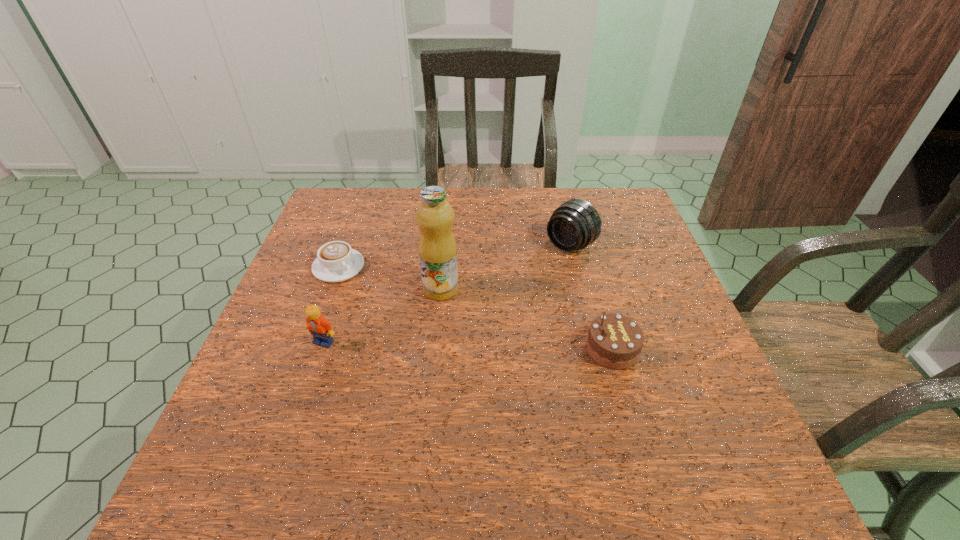
Locate an element on the screen. The height and width of the screenshot is (540, 960). free space that satisfies the following two spatial constraints: 1. on the front side of the cappuccino; 2. on the right side of the tallest object is located at coordinates (330, 289).

This screenshot has width=960, height=540. Find the location of `free region that satisfies the following two spatial constraints: 1. on the front side of the cappuccino; 2. on the right side of the chocolate cake`. free region that satisfies the following two spatial constraints: 1. on the front side of the cappuccino; 2. on the right side of the chocolate cake is located at coordinates (309, 349).

Find the location of `free space that satisfies the following two spatial constraints: 1. on the back side of the second tallest object; 2. on the right side of the third object from left to right`. free space that satisfies the following two spatial constraints: 1. on the back side of the second tallest object; 2. on the right side of the third object from left to right is located at coordinates (445, 245).